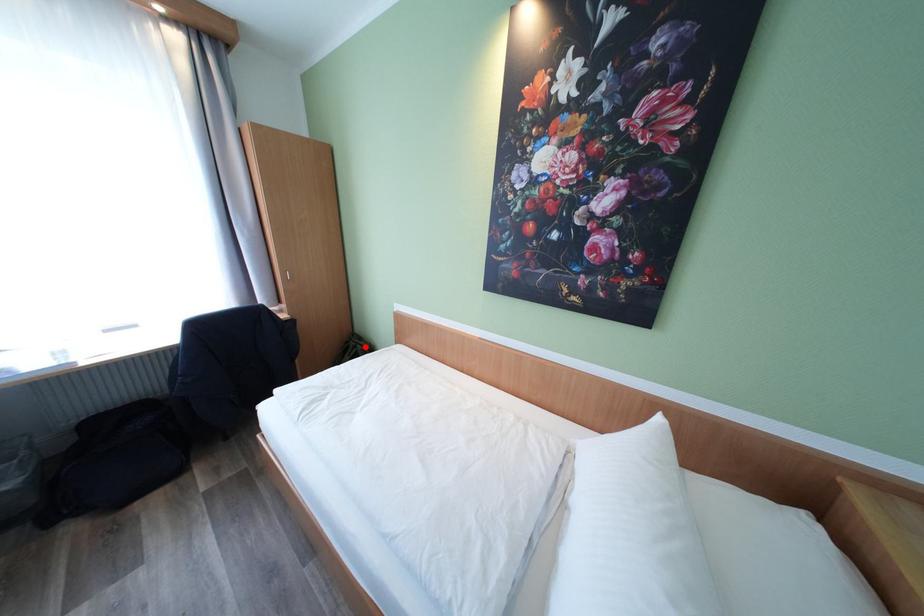
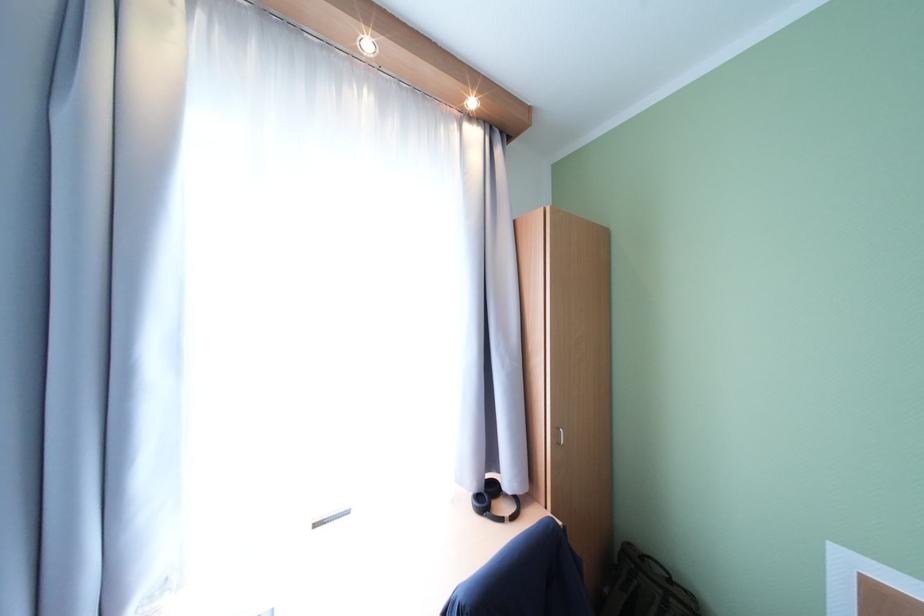
Question: I am providing you with two images of the same scene from different viewpoints. Image1 has a red point marked. In image2, the corresponding 3D location appears at what relative position? Reply with the corresponding letter.

Choices:
 (A) Closer
 (B) Farther

Answer: (A)